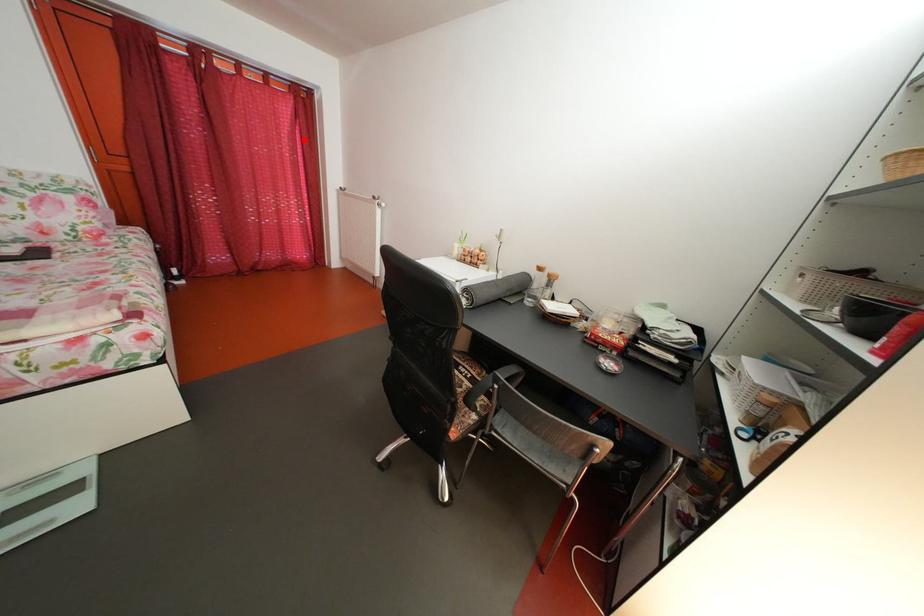
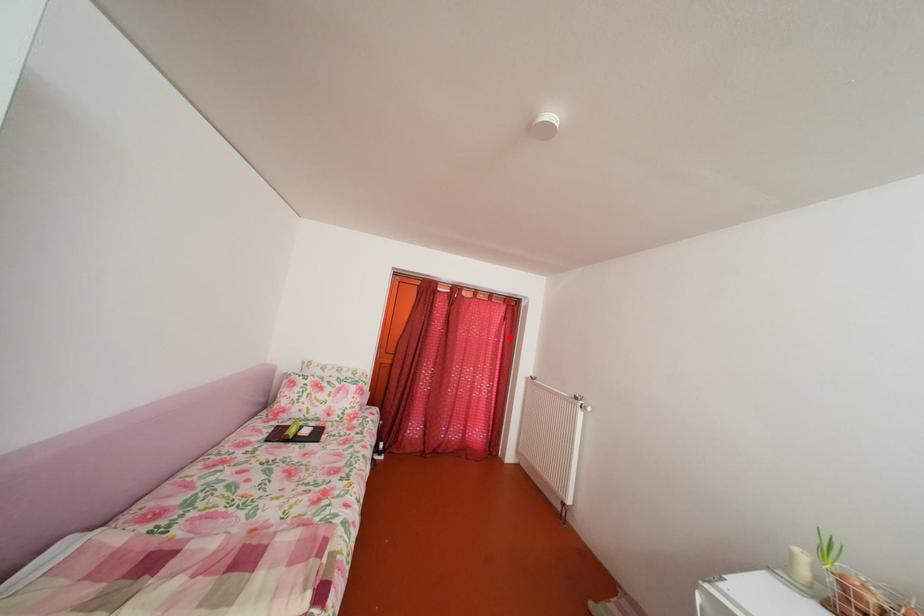
I am providing you with two images of the same scene from different viewpoints. A red point is marked on the first image and another point is marked on the second image. Are the points marked in image1 and image2 representing the same 3D position?

Yes